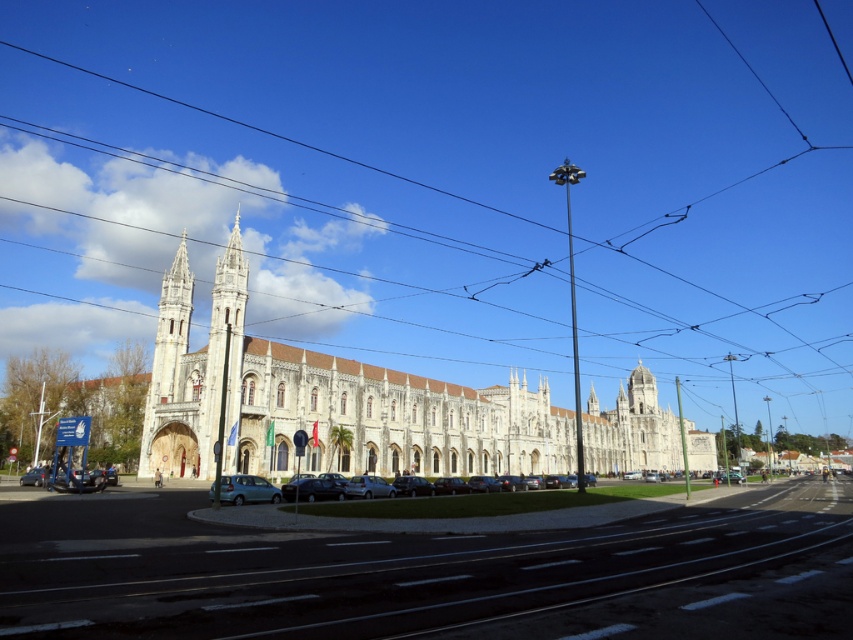
Is point (242, 372) in front of point (202, 419)?

No, (242, 372) is further to viewer.

Is point (245, 451) positioned behind point (227, 403)?

Yes, it is.

Identify the location of white stone church at center. This screenshot has width=853, height=640. (325, 403).

Is point (844, 225) closer to camera compared to point (247, 492)?

No, (844, 225) is behind (247, 492).

Locate an element on the screen. This screenshot has height=640, width=853. black wire at upper center is located at coordinates (444, 188).

This screenshot has width=853, height=640. I want to click on black wire at upper center, so click(444, 188).

Is white stone church at center closer to camera compared to teal matte car at lower left?

No, it is behind teal matte car at lower left.

Is point (669, 460) more distant than point (242, 477)?

Yes.

In order to click on white stone church at center in this screenshot , I will do coord(325,403).